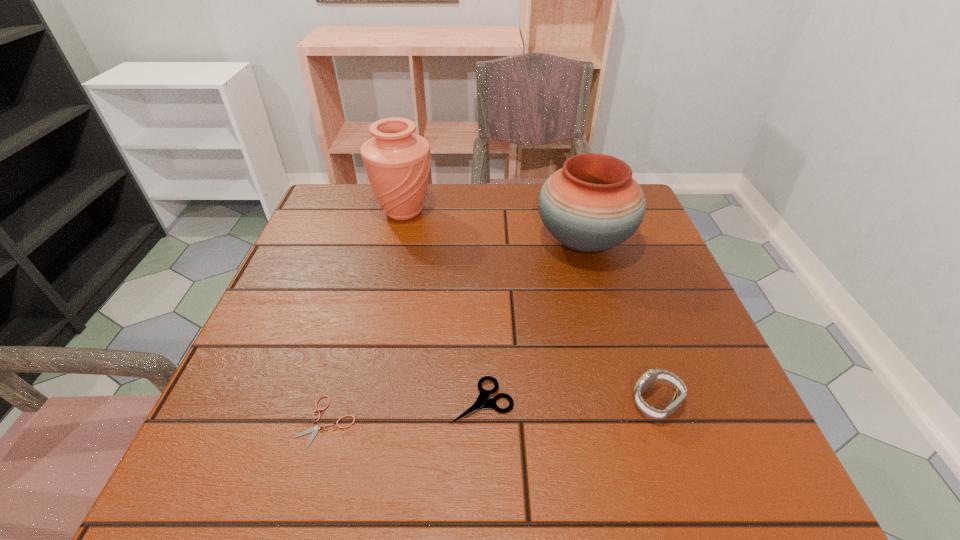
Where is `watch that is at the right edge`? The height and width of the screenshot is (540, 960). watch that is at the right edge is located at coordinates (651, 376).

Where is `object that is positioned at the far left corner`? The width and height of the screenshot is (960, 540). object that is positioned at the far left corner is located at coordinates (397, 162).

Locate an element on the screen. This screenshot has width=960, height=540. object that is at the near left corner is located at coordinates tap(315, 428).

At what (x,y) coordinates should I click in order to perform the action: click on object at the far right corner. Please return your answer as a coordinate pair (x, y). Looking at the image, I should click on (592, 204).

Where is `free space at the far edge`? This screenshot has width=960, height=540. free space at the far edge is located at coordinates (477, 198).

Locate an element on the screen. The width and height of the screenshot is (960, 540). free space at the near edge is located at coordinates (442, 457).

Locate an element on the screen. Image resolution: width=960 pixels, height=540 pixels. vacant region at the left edge is located at coordinates (x=325, y=360).

This screenshot has height=540, width=960. In order to click on free space at the right edge of the desktop in this screenshot , I will do `click(679, 329)`.

The height and width of the screenshot is (540, 960). In the image, there is a desktop. Identify the location of free space at the far left corner. (324, 214).

Find the location of a particular element. This screenshot has width=960, height=540. free space that is in between the third tallest object and the shortest object is located at coordinates (492, 411).